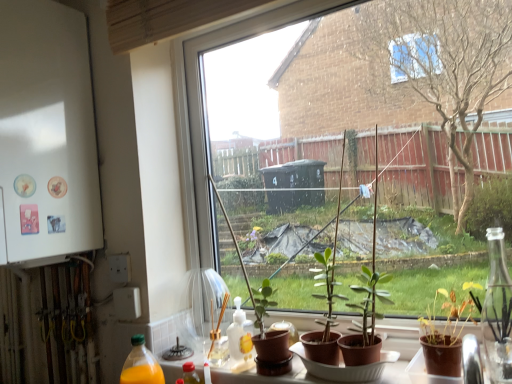
Question: Is brown matte pot at lower right, the 2th houseplant positioned from the back, beside green matte plant at center, placed as the second houseplant when sorted from front to back?

Choices:
 (A) yes
 (B) no

Answer: (B)

Question: Is brown matte pot at lower right, the 2th houseplant positioned from the left, closer to the viewer compared to green matte plant at center, the first houseplant viewed from the back?

Choices:
 (A) no
 (B) yes

Answer: (B)

Question: From the image's perspective, is brown matte pot at lower right, placed as the first houseplant when sorted from front to back, under green matte plant at center, marked as the second houseplant in a right-to-left arrangement?

Choices:
 (A) no
 (B) yes

Answer: (A)

Question: From the image's perspective, does brown matte pot at lower right, the 2th houseplant positioned from the back, appear higher than green matte plant at center, which ranks as the first houseplant in left-to-right order?

Choices:
 (A) yes
 (B) no

Answer: (A)

Question: Can green matte plant at center, which ranks as the first houseplant in left-to-right order, be found inside brown matte pot at lower right, the 2th houseplant positioned from the left?

Choices:
 (A) yes
 (B) no

Answer: (B)

Question: Is point (252, 307) closer or farther from the camera than point (76, 119)?

Choices:
 (A) farther
 (B) closer

Answer: (B)

Question: Is green matte plant at center, placed as the second houseplant when sorted from front to back, spatially inside white matte refrigerator at left, or outside of it?

Choices:
 (A) outside
 (B) inside

Answer: (A)

Question: From their relative heights in the image, would you say green matte plant at center, the first houseplant viewed from the back, is taller or shorter than white matte refrigerator at left?

Choices:
 (A) tall
 (B) short

Answer: (B)

Question: From the image's perspective, relative to white matte refrigerator at left, is green matte plant at center, the first houseplant viewed from the back, above or below?

Choices:
 (A) above
 (B) below

Answer: (B)

Question: In terms of width, does brown matte pot at lower right, the 2th houseplant positioned from the left, look wider or thinner when compared to transparent glass window at center?

Choices:
 (A) wide
 (B) thin

Answer: (A)

Question: Is brown matte pot at lower right, which is counted as the 1th houseplant, starting from the right, taller or shorter than transparent glass window at center?

Choices:
 (A) short
 (B) tall

Answer: (A)

Question: From a real-world perspective, relative to transparent glass window at center, is brown matte pot at lower right, which is counted as the 1th houseplant, starting from the right, vertically above or below?

Choices:
 (A) above
 (B) below

Answer: (B)

Question: From the image's perspective, is brown matte pot at lower right, the 2th houseplant positioned from the left, located above or below transparent glass window at center?

Choices:
 (A) above
 (B) below

Answer: (B)

Question: Is brown matte pot at lower right, the 2th houseplant positioned from the left, taller or shorter than white matte refrigerator at left?

Choices:
 (A) tall
 (B) short

Answer: (B)

Question: Does point (444, 367) appear closer or farther from the camera than point (79, 44)?

Choices:
 (A) closer
 (B) farther

Answer: (A)